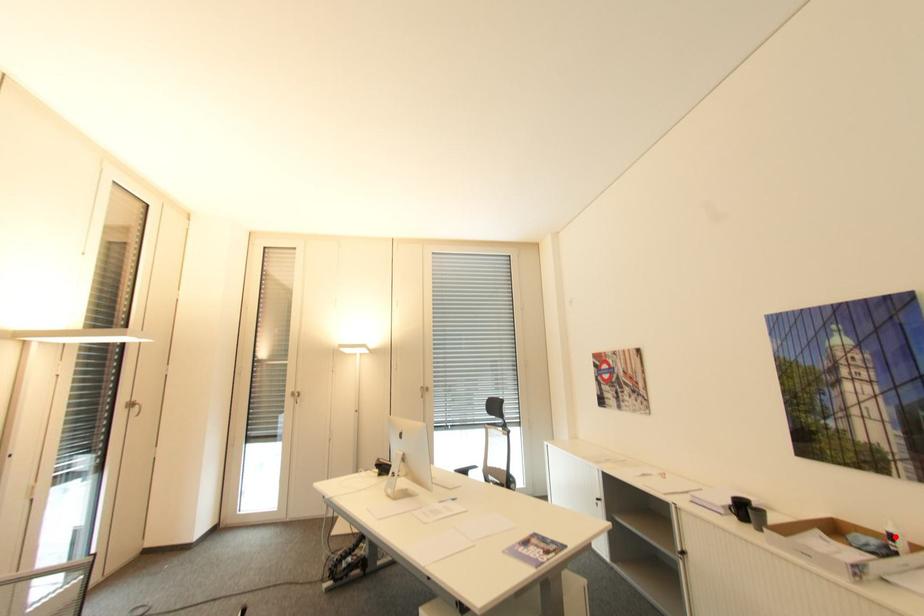
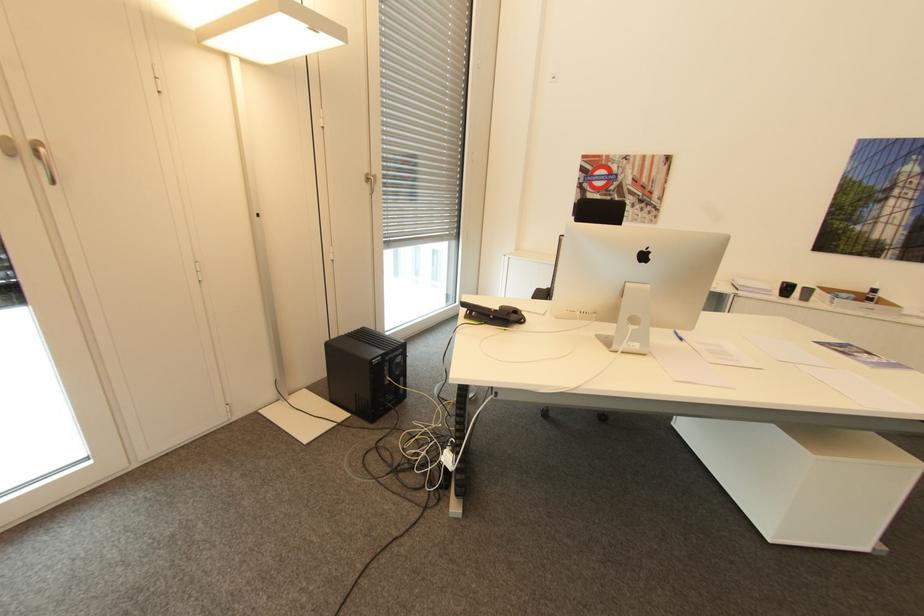
In the second image, find the point that corresponds to the highlighted location in the first image.

(879, 290)